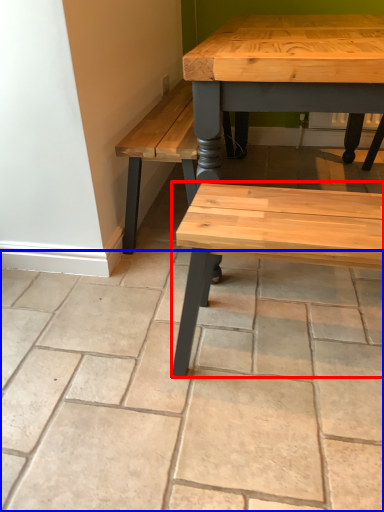
Question: Which object appears closest to the camera in this image, bench (highlighted by a red box) or concrete (highlighted by a blue box)?

Choices:
 (A) bench
 (B) concrete

Answer: (B)